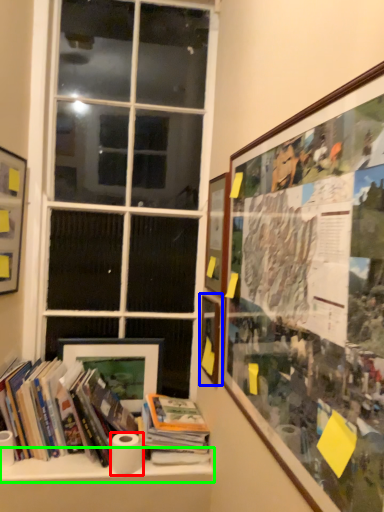
Question: Estimate the real-world distances between objects in this image. Which object is farther from toilet paper (highlighted by a red box), picture frame (highlighted by a blue box) or window sill (highlighted by a green box)?

Choices:
 (A) picture frame
 (B) window sill

Answer: (A)